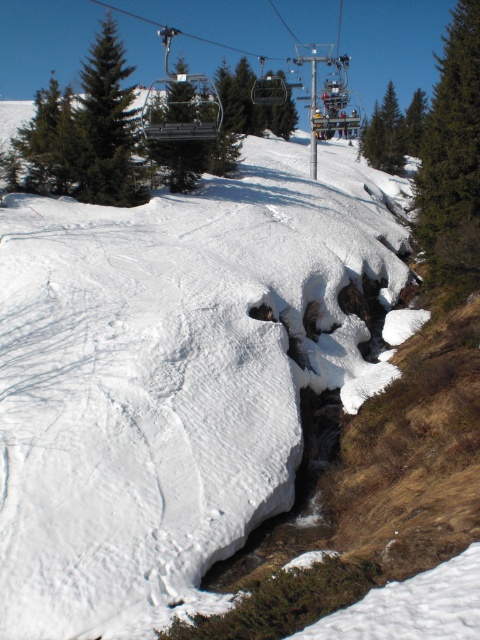
Question: Which point is closer to the camera taking this photo?

Choices:
 (A) (448, 224)
 (B) (87, 193)

Answer: (A)

Question: Does green textured pine at right have a lesser width compared to green matte pine at upper left?

Choices:
 (A) no
 (B) yes

Answer: (B)

Question: Is green textured pine at right thinner than green matte pine at upper left?

Choices:
 (A) yes
 (B) no

Answer: (A)

Question: Which point is farther to the camera?

Choices:
 (A) green textured pine at right
 (B) green matte pine at upper left

Answer: (B)

Question: Is green textured pine at right above green matte pine at upper left?

Choices:
 (A) no
 (B) yes

Answer: (A)